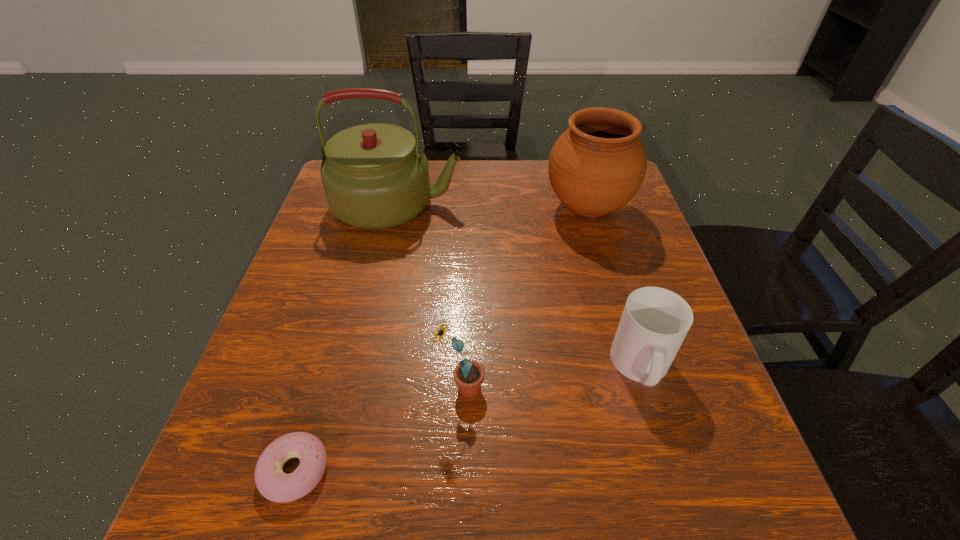
I want to click on vacant space located on the back of the doughnut, so click(348, 285).

Locate an element on the screen. kettle situated at the far edge is located at coordinates (374, 176).

Locate an element on the screen. This screenshot has height=540, width=960. pottery located in the far edge section of the desktop is located at coordinates (598, 164).

The image size is (960, 540). Find the location of `object that is at the near edge`. object that is at the near edge is located at coordinates (275, 485).

Where is `kettle situated at the left edge`? kettle situated at the left edge is located at coordinates (374, 176).

I want to click on doughnut that is positioned at the left edge, so click(275, 485).

Locate an element on the screen. The width and height of the screenshot is (960, 540). pottery positioned at the right edge is located at coordinates (598, 164).

Locate an element on the screen. The height and width of the screenshot is (540, 960). mug at the right edge is located at coordinates (655, 321).

This screenshot has height=540, width=960. In order to click on object that is at the far left corner in this screenshot , I will do (x=374, y=176).

In order to click on object present at the near left corner in this screenshot , I will do `click(275, 485)`.